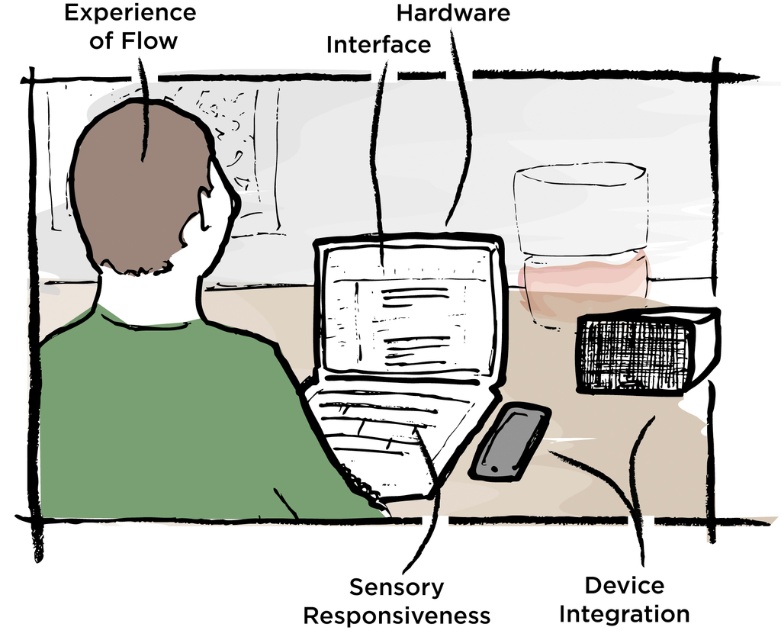
Question: Observing the image, what is the correct spatial positioning of matte black laptop at center in reference to green matte shirt at center?

Choices:
 (A) right
 (B) left

Answer: (A)

Question: Is matte black laptop at center closer to the viewer compared to green matte shirt at center?

Choices:
 (A) no
 (B) yes

Answer: (A)

Question: Does matte black laptop at center lie in front of green matte shirt at center?

Choices:
 (A) yes
 (B) no

Answer: (B)

Question: Which object appears closest to the camera in this image?

Choices:
 (A) green matte shirt at center
 (B) matte black laptop at center

Answer: (A)

Question: Which of the following is the closest to the observer?

Choices:
 (A) (580, 248)
 (B) (166, 388)

Answer: (B)

Question: Which object appears closest to the camera in this image?

Choices:
 (A) green matte shirt at center
 (B) matte black laptop at center

Answer: (A)